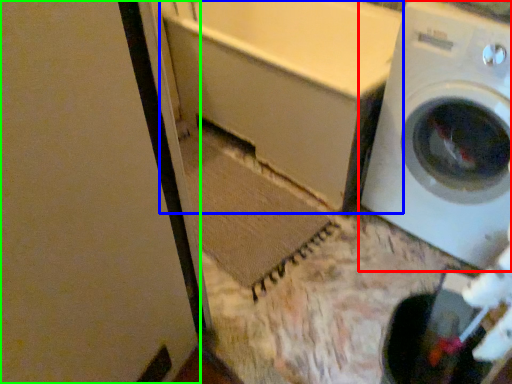
Question: Which is farther away from washing machine (highlighted by a red box)? bath (highlighted by a blue box) or screen door (highlighted by a green box)?

Choices:
 (A) bath
 (B) screen door

Answer: (B)